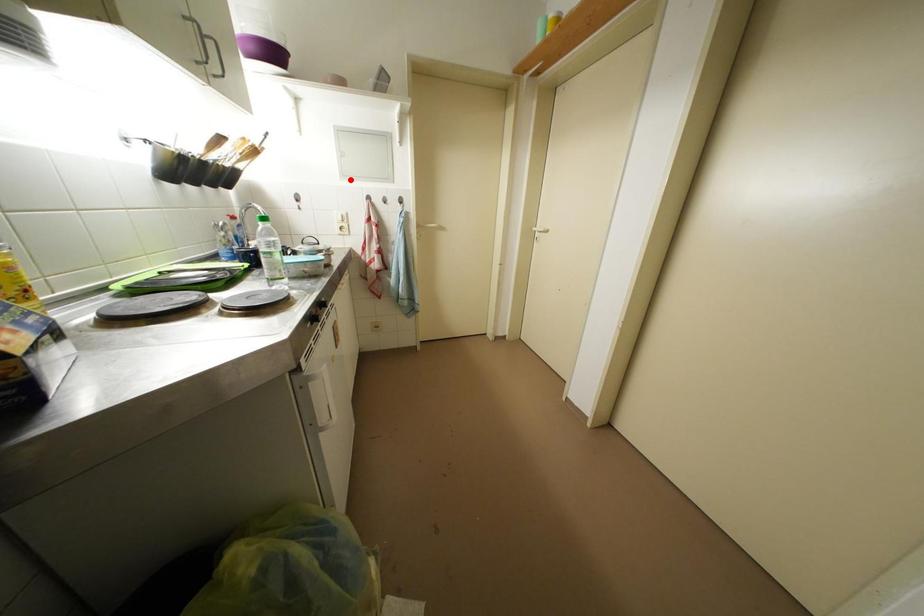
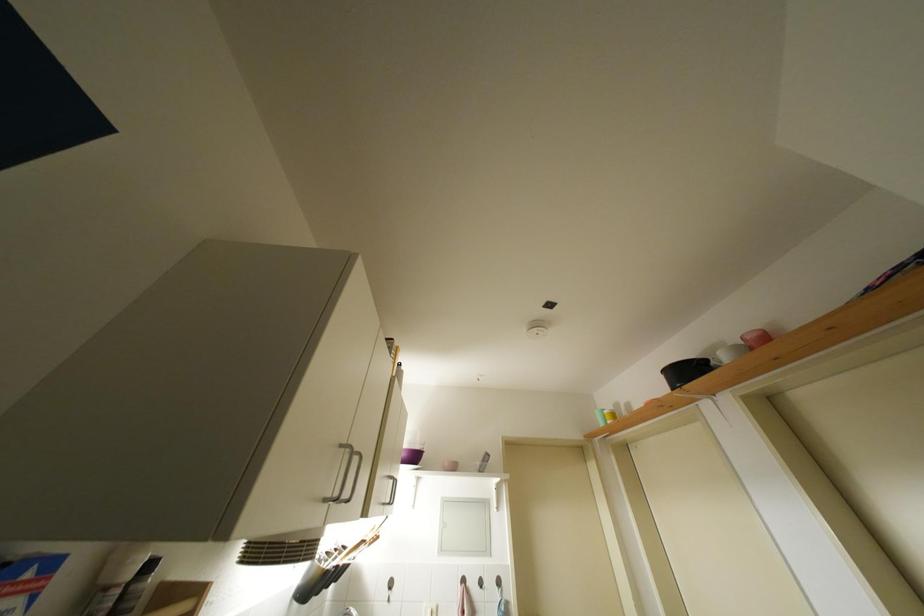
Question: I am providing you with two images of the same scene from different viewpoints. Given a red point in image1, look at the same physical point in image2. Is it:

Choices:
 (A) Closer to the viewpoint
 (B) Farther from the viewpoint

Answer: (B)